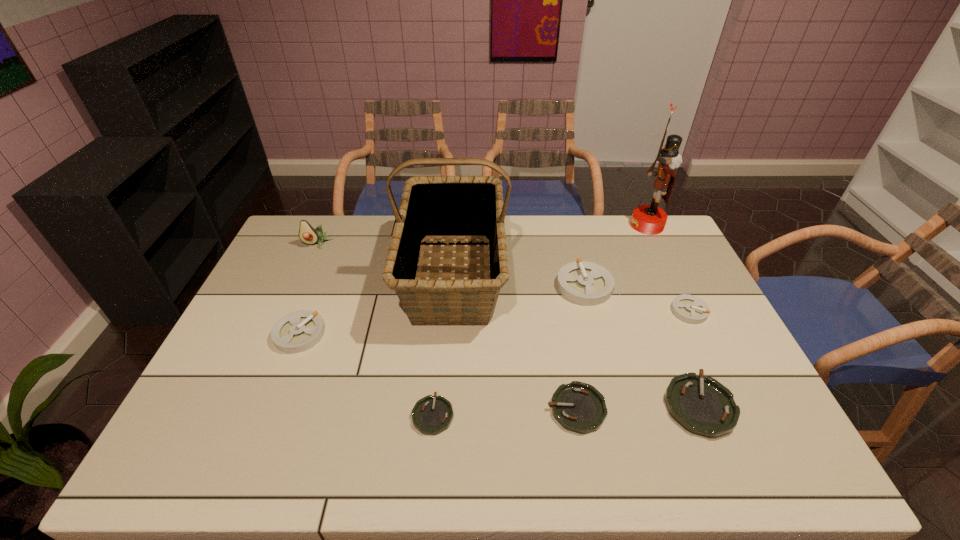
Image resolution: width=960 pixels, height=540 pixels. Identify the location of the leftmost green ashtray. (431, 415).

The width and height of the screenshot is (960, 540). Find the location of `the smallest green ashtray`. the smallest green ashtray is located at coordinates (431, 415).

Identify the location of vacant area located on the front-facing side of the nutcracker. (591, 225).

Locate an element on the screen. This screenshot has height=540, width=960. vacant space located 0.390m on the front-facing side of the nutcracker is located at coordinates (529, 225).

Find the location of a particular element. vacant space located on the front-facing side of the nutcracker is located at coordinates (565, 225).

What are the coordinates of `vacant space located by the handle of the basket` in the screenshot? It's located at tap(442, 446).

Locate an element on the screen. free region located on the seed side of the seventh shortest object is located at coordinates (300, 281).

This screenshot has width=960, height=540. What are the coordinates of `vacant space situated on the back of the sixth shortest object` in the screenshot? It's located at pos(574,246).

You are a GUI agent. You are given a task and a screenshot of the screen. Output one action in this format:
    pyautogui.click(x=<x>, y=<y>)
    Task: Click on the free space located 0.260m on the back of the fifth shortest ashtray
    The width and height of the screenshot is (960, 540).
    Given the screenshot: What is the action you would take?
    pyautogui.click(x=328, y=261)

Locate an element on the screen. Image resolution: width=960 pixels, height=540 pixels. free spot located 0.170m on the left of the rightmost green ashtray is located at coordinates (598, 406).